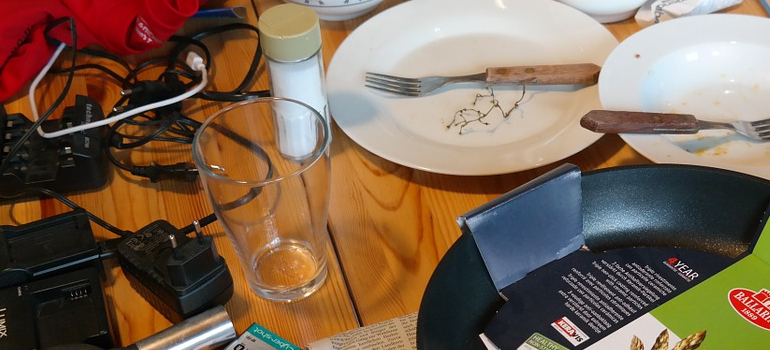
I want to click on fork, so click(x=420, y=78), click(x=737, y=125).